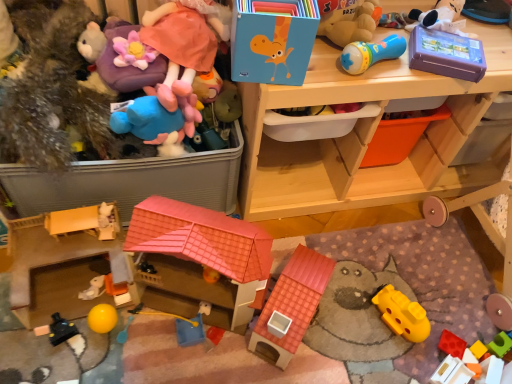
You are a GUI agent. You are given a task and a screenshot of the screen. Output one action in this format:
    pyautogui.click(x=<x>, y=<y>)
    Task: Click on the vacant space that's between rubberized red block at lower right, which appears as the 2th toy when viewed from the right, and black plastic toy at lower left, positioned as the 2th toy in left-to-right order
    
    Given the screenshot: What is the action you would take?
    pyautogui.click(x=269, y=345)